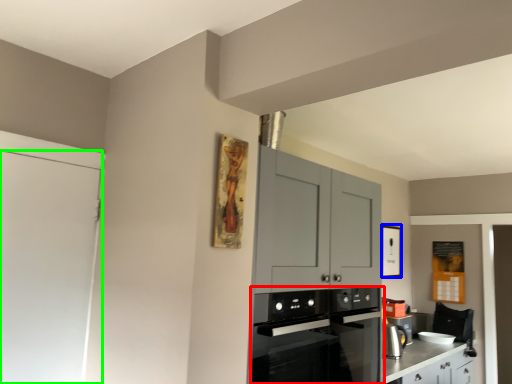
Question: Based on their relative distances, which object is nearer to kitchen appliance (highlighted by a red box)? Choose from picture frame (highlighted by a blue box) and door (highlighted by a green box).

Choices:
 (A) picture frame
 (B) door

Answer: (B)